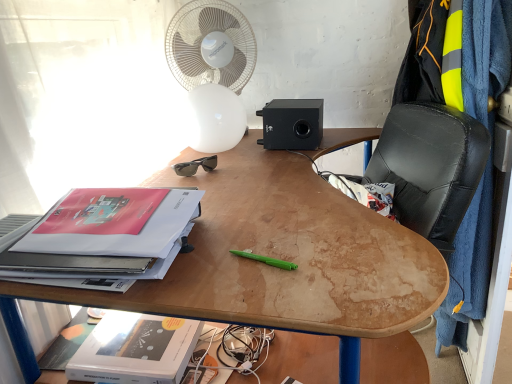
This screenshot has height=384, width=512. Identify the location of vacant area that lies between black plastic speaker at upper center and black plastic sunglasses at upper center. (256, 155).